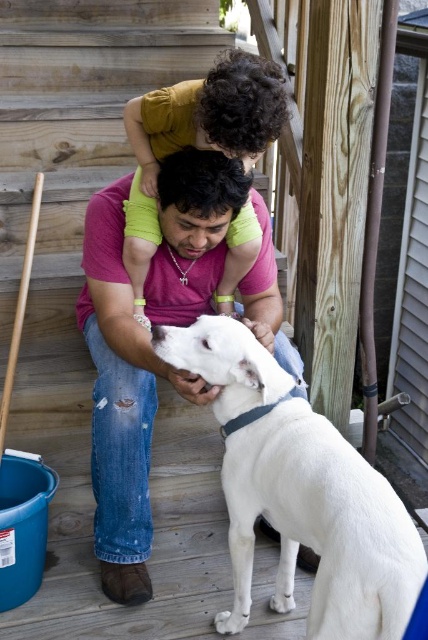
You are a photographer trying to capture a candid shot of the scene. You want to ensure that both the white matte dog at center and the matte pink shirt at center are in focus. Given that your camera has a depth of field that can cover 12 inches, will you need to adjust your settings to include both subjects?

The white matte dog at center and the matte pink shirt at center are 13.08 inches apart. Since the distance between them exceeds the camera depth of field of 12 inches, you will need to adjust your settings to ensure both are in focus.